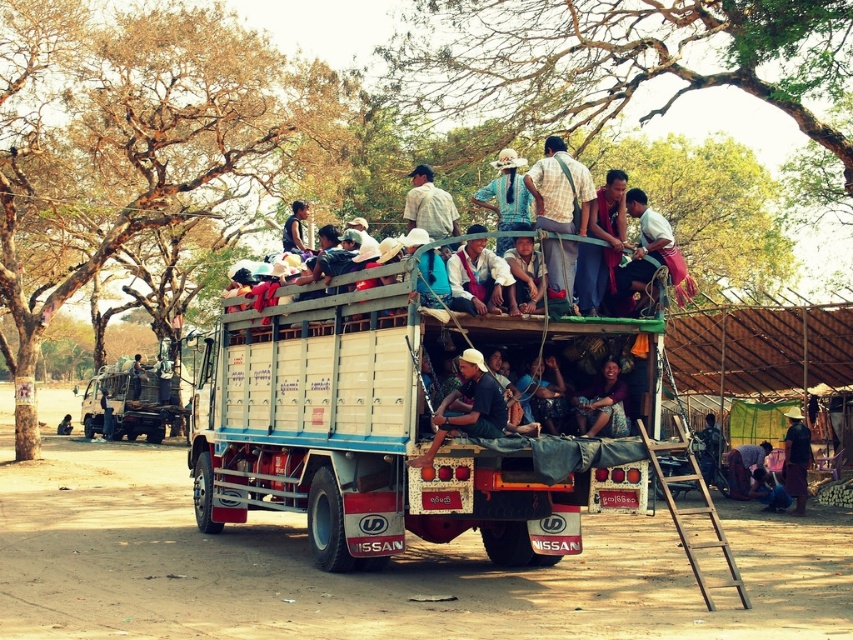
You are standing at the origin point of the image. There is a point at coordinate point (x=560, y=189). What object is located at that position?

The point at coordinate point (x=560, y=189) is the checkered fabric shirt at center.

You are observing a rural scene with a truck under trees. There are two people wearing a checkered fabric shirt at center and a matte purple shirt at center. Which person is shorter?

The checkered fabric shirt at center has a lesser height compared to matte purple shirt at center, so the person wearing the checkered fabric shirt at center is shorter.

You are a photographer taking a picture of the rural scene. You notice two people wearing the checkered fabric shirt at center and the matte purple shirt at center. Which shirt will appear closer to the camera in the photo?

The checkered fabric shirt at center will appear closer to the camera in the photo because it is in front of the matte purple shirt at center.